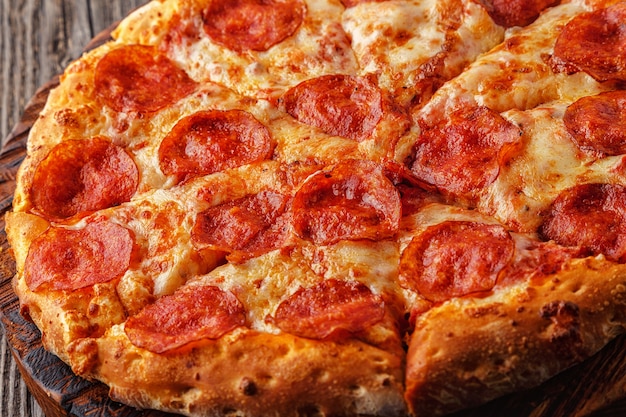
This screenshot has height=417, width=626. I want to click on wood platform, so click(x=4, y=394), click(x=19, y=394), click(x=27, y=397), click(x=4, y=62), click(x=16, y=64), click(x=26, y=65), click(x=34, y=65), click(x=57, y=62), click(x=78, y=47).